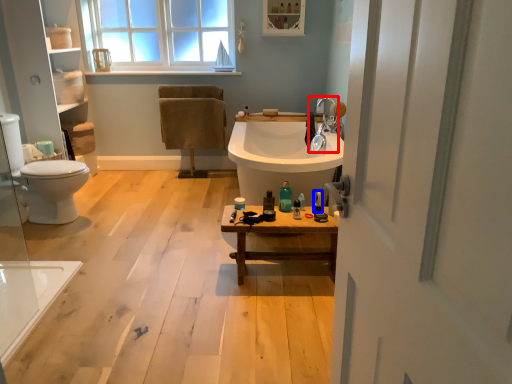
Question: Which object is further to the camera taking this photo, tap (highlighted by a red box) or toiletry (highlighted by a blue box)?

Choices:
 (A) tap
 (B) toiletry

Answer: (A)